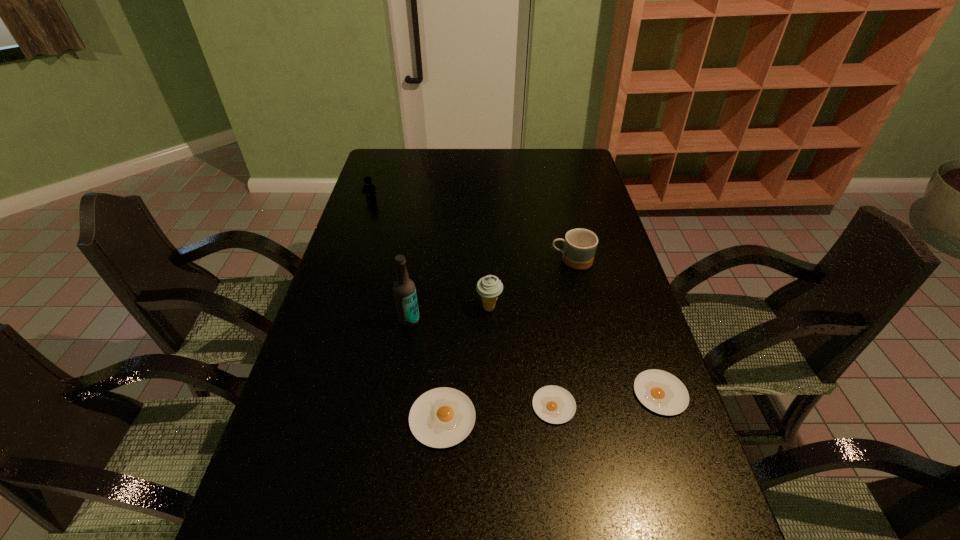
The height and width of the screenshot is (540, 960). I want to click on egg yolk that is the second closest to the icecream, so click(553, 404).

This screenshot has width=960, height=540. In order to click on the closest egg yolk to the second shortest egg yolk in this screenshot , I will do `click(553, 404)`.

In order to click on free spot that satisfies the following two spatial constraints: 1. on the label of the fifth tallest object; 2. on the right side of the sixth object from right to left in this screenshot , I will do `click(395, 418)`.

The width and height of the screenshot is (960, 540). What are the coordinates of `free space that satisfies the following two spatial constraints: 1. on the front-facing side of the leftmost object; 2. on the right side of the leftmost egg yolk` in the screenshot? It's located at (300, 418).

Find the location of a particular element. The width and height of the screenshot is (960, 540). free space that satisfies the following two spatial constraints: 1. on the label of the beer bottle; 2. on the right side of the shortest object is located at coordinates click(x=396, y=406).

At what (x,y) coordinates should I click in order to perform the action: click on free space that satisfies the following two spatial constraints: 1. on the label of the shortest egg yolk; 2. on the left side of the beer bottle. Please return your answer as a coordinate pair (x, y). Looking at the image, I should click on (396, 406).